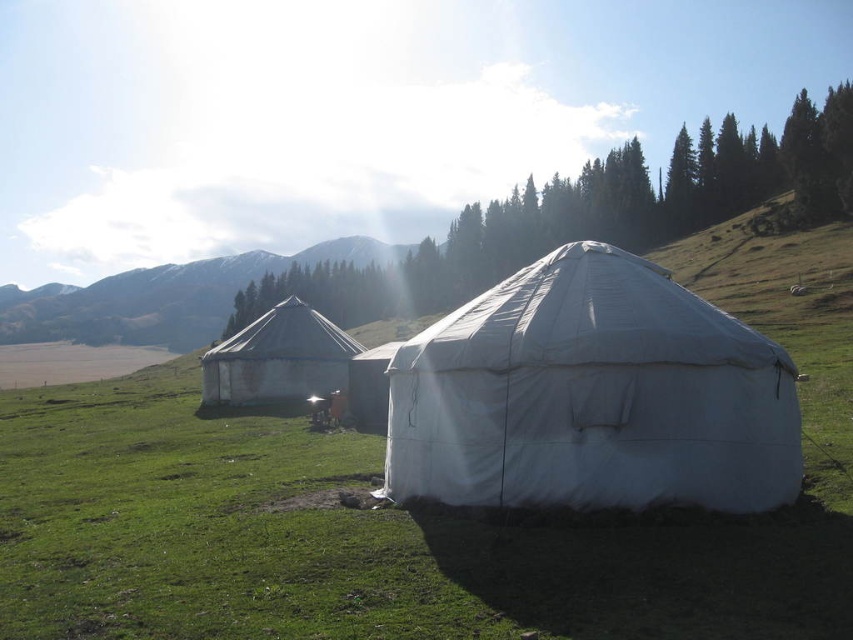
Between white fabric tent at center and white canvas tent at left, which one has less height?

white canvas tent at left is shorter.

Who is positioned more to the left, white fabric tent at center or white canvas tent at left?

Positioned to the left is white fabric tent at center.

Between point (387, 260) and point (224, 400), which one is positioned in front?

Positioned in front is point (224, 400).

Image resolution: width=853 pixels, height=640 pixels. I want to click on white fabric tent at center, so click(166, 296).

Which is in front, point (749, 330) or point (244, 326)?

Point (749, 330) is in front.

Can you confirm if white canvas tent at center is smaller than white canvas tent at left?

Yes.

Who is more distant from viewer, (543, 477) or (236, 385)?

The point (236, 385) is behind.

This screenshot has height=640, width=853. Find the location of `white canvas tent at center`. white canvas tent at center is located at coordinates (592, 396).

Does point (463, 458) come closer to viewer compared to point (352, 253)?

Yes, it is.

Which is below, white canvas tent at center or white fabric tent at center?

white canvas tent at center is lower down.

Measure the distance between white canvas tent at center and camera.

The distance of white canvas tent at center from camera is 7.72 meters.

The image size is (853, 640). I want to click on white canvas tent at center, so click(x=592, y=396).